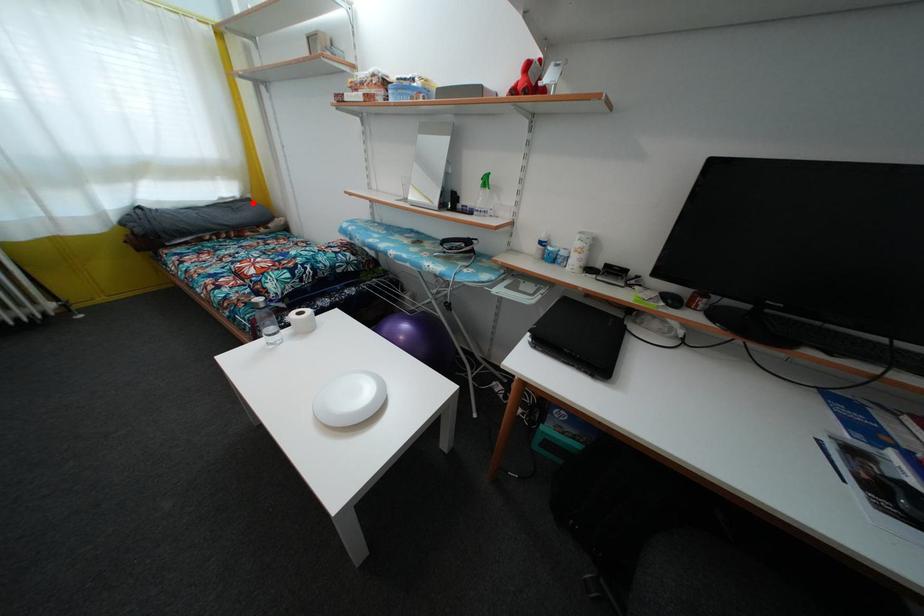
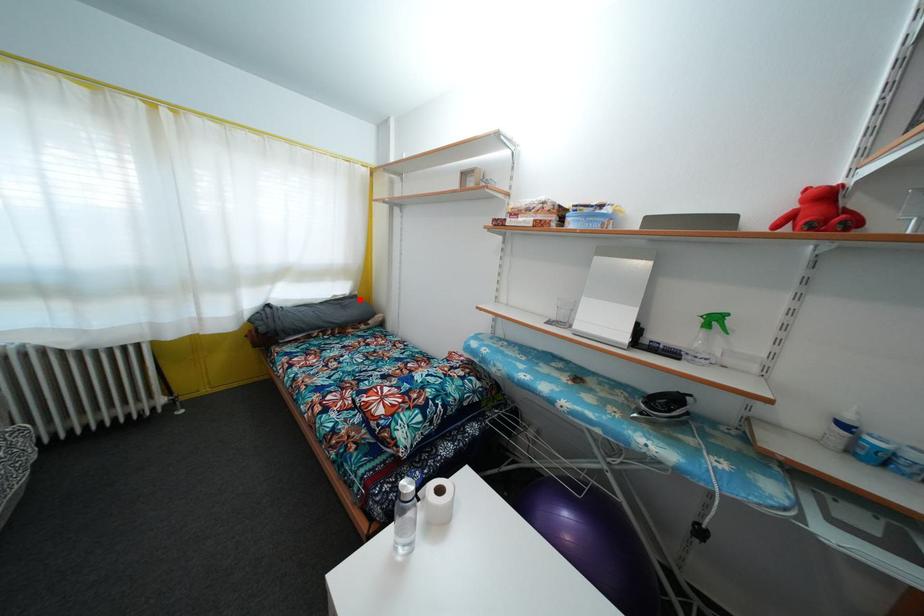
I am providing you with two images of the same scene from different viewpoints. A red point is marked on the first image and another point is marked on the second image. Is the marked point in image1 the same physical position as the marked point in image2?

Yes